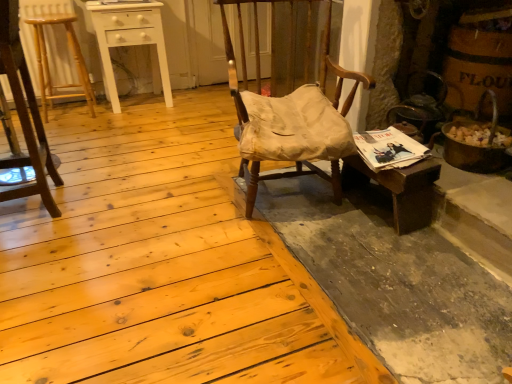
This screenshot has width=512, height=384. Find the location of `vacant region below wooden stool at left, the first chair in the left-to-right sequence (from a real-world perspective)`. vacant region below wooden stool at left, the first chair in the left-to-right sequence (from a real-world perspective) is located at coordinates 34,206.